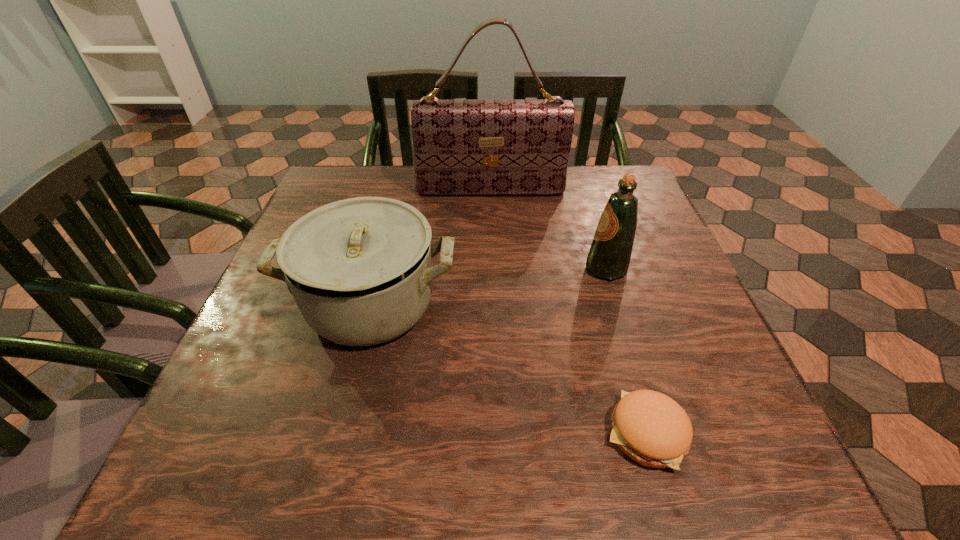
Identify the location of the farthest object. (460, 147).

Locate an element on the screen. The height and width of the screenshot is (540, 960). handbag is located at coordinates (x=460, y=147).

The image size is (960, 540). What are the coordinates of `olive oil` in the screenshot? It's located at (609, 256).

Find the location of a particular element. The height and width of the screenshot is (540, 960). saucepan is located at coordinates (360, 270).

Find the location of a particular element. The width and height of the screenshot is (960, 540). the nearest object is located at coordinates (651, 428).

Image resolution: width=960 pixels, height=540 pixels. In order to click on patty in this screenshot , I will do `click(651, 428)`.

You are a GUI agent. You are given a task and a screenshot of the screen. Output one action in this format:
    pyautogui.click(x=<x>, y=<y>)
    Task: Click on the vacant space located 0.190m on the front of the tallest object with the clasp
    The width and height of the screenshot is (960, 540).
    Given the screenshot: What is the action you would take?
    pyautogui.click(x=492, y=248)

The image size is (960, 540). Find the location of `vacant space situated on the front-facing side of the olive oil`. vacant space situated on the front-facing side of the olive oil is located at coordinates (406, 268).

Image resolution: width=960 pixels, height=540 pixels. Identify the location of free spot located 0.190m on the front-facing side of the olive oil. [x=495, y=268].

Locate an element on the screen. vacant region located 0.130m on the front-facing side of the olive oil is located at coordinates (524, 268).